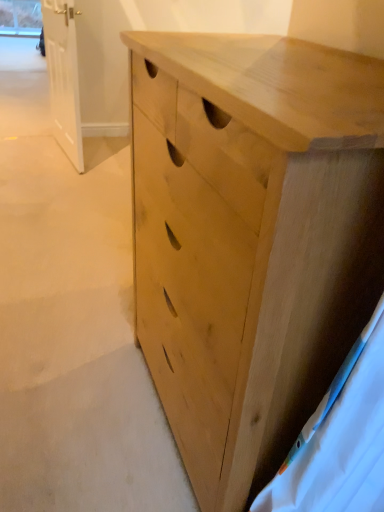
This screenshot has height=512, width=384. Find the location of `white glossy door at upper left`. white glossy door at upper left is located at coordinates (63, 77).

What do you see at coordinates (63, 77) in the screenshot? The width and height of the screenshot is (384, 512). I see `white glossy door at upper left` at bounding box center [63, 77].

Where is `white glossy door at upper left`? The width and height of the screenshot is (384, 512). white glossy door at upper left is located at coordinates (63, 77).